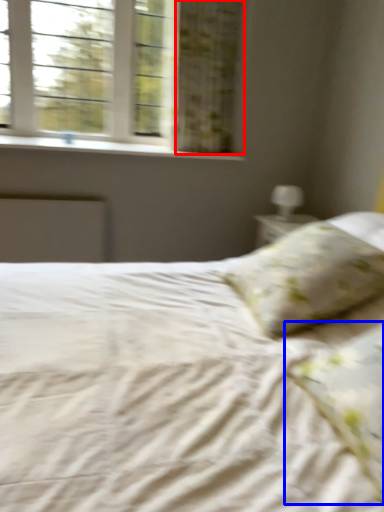
Question: Which point is closer to the camera, curtain (highlighted by a red box) or pillow (highlighted by a blue box)?

Choices:
 (A) curtain
 (B) pillow

Answer: (B)